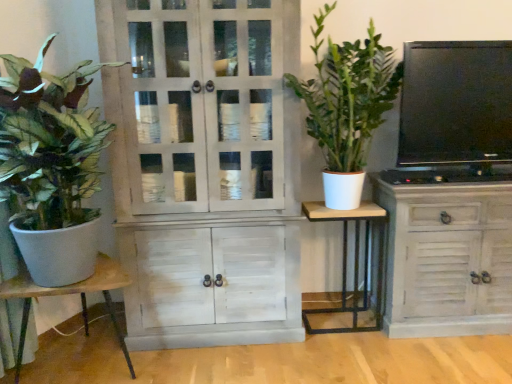
Question: Would you say green matte plant at left, positioned as the second houseplant in right-to-left order, is to the left or to the right of distressed white cabinet at right, the 2th cabinetry positioned from the left, in the picture?

Choices:
 (A) left
 (B) right

Answer: (A)

Question: Choose the correct answer: Is green matte plant at left, positioned as the second houseplant in right-to-left order, inside distressed white cabinet at right, acting as the first cabinetry starting from the right, or outside it?

Choices:
 (A) inside
 (B) outside

Answer: (B)

Question: Estimate the real-world distances between objects in this image. Which object is farther from the green matte plant at center, which is counted as the second houseplant, starting from the left?

Choices:
 (A) matte black tv at upper right
 (B) wooden table at left, which is the first table from left to right
 (C) distressed white cabinet at right, the 2th cabinetry positioned from the left
 (D) white wood table at center, which is the 1th table in right-to-left order
 (E) green matte plant at left, positioned as the second houseplant in right-to-left order

Answer: (B)

Question: Considering the real-world distances, which object is closest to the white wood table at center, which is the 1th table in right-to-left order?

Choices:
 (A) wooden table at left, which is the first table from left to right
 (B) distressed white cabinet at right, acting as the first cabinetry starting from the right
 (C) white wood cabinet at center, which is counted as the 2th cabinetry, starting from the right
 (D) green matte plant at left, the 1th houseplant from the left
 (E) green matte plant at center, which is counted as the second houseplant, starting from the left

Answer: (B)